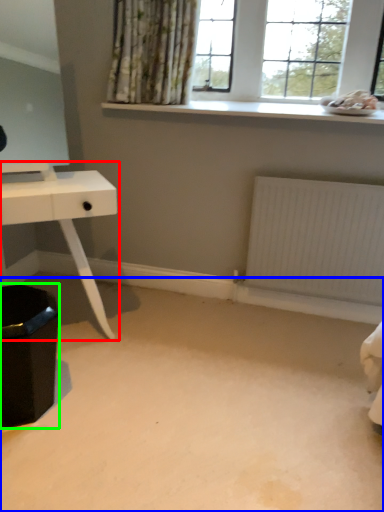
Question: Which object is the farthest from table (highlighted by a red box)? Choose among these: plain (highlighted by a blue box) or step stool (highlighted by a green box).

Choices:
 (A) plain
 (B) step stool

Answer: (A)